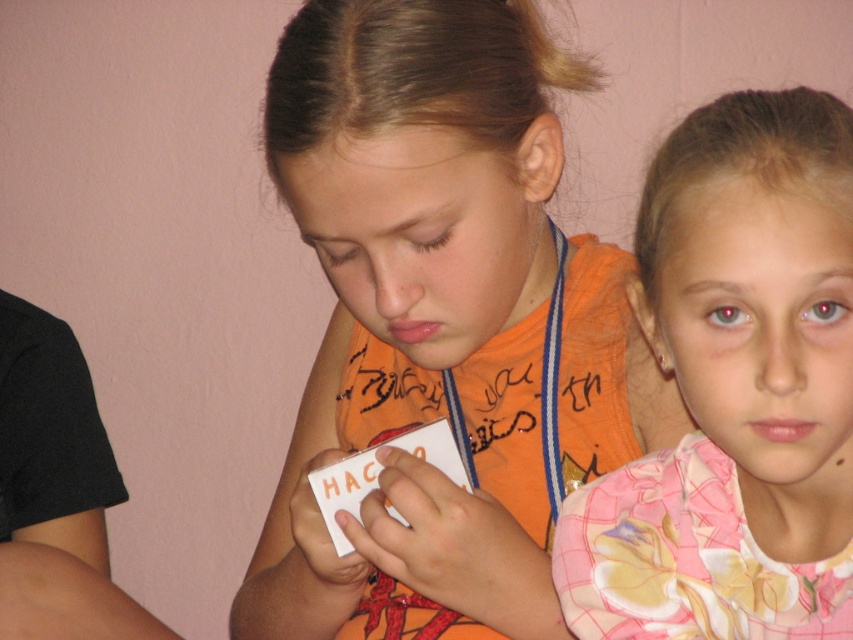
Question: Considering the real-world distances, which object is farthest from the pink floral shirt at upper right?

Choices:
 (A) white paper card at center
 (B) orange fabric shirt at center

Answer: (A)

Question: Can you confirm if pink floral shirt at upper right is positioned below white paper card at center?

Choices:
 (A) yes
 (B) no

Answer: (B)

Question: Which point appears farthest from the camera in this image?

Choices:
 (A) (724, 448)
 (B) (634, 401)
 (C) (442, 458)

Answer: (B)

Question: Does orange fabric shirt at center have a larger size compared to white paper card at center?

Choices:
 (A) no
 (B) yes

Answer: (B)

Question: Based on their relative distances, which object is farther from the white paper card at center?

Choices:
 (A) orange fabric shirt at center
 (B) pink floral shirt at upper right

Answer: (B)

Question: Is orange fabric shirt at center thinner than pink floral shirt at upper right?

Choices:
 (A) no
 (B) yes

Answer: (A)